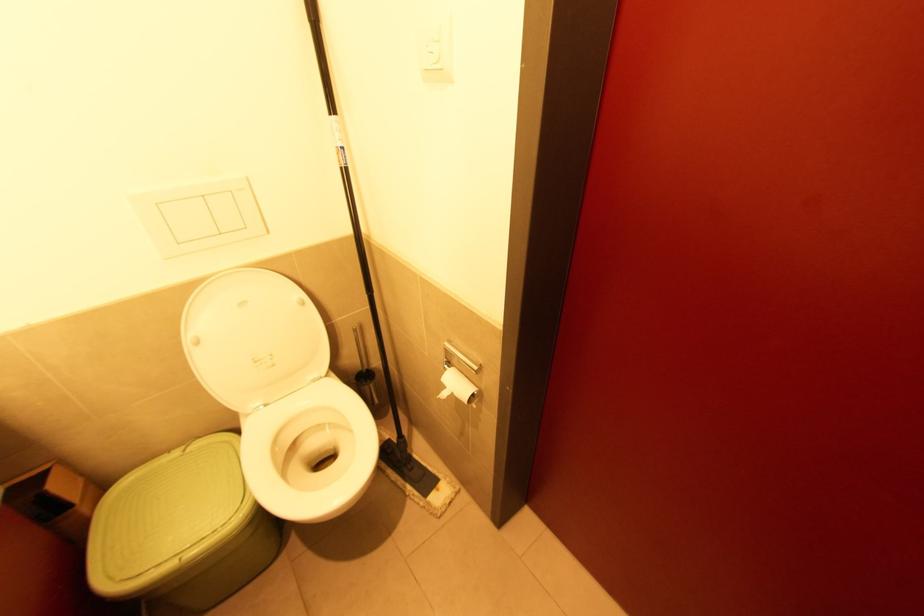
Identify the location of white light switch. The width and height of the screenshot is (924, 616). (435, 50).